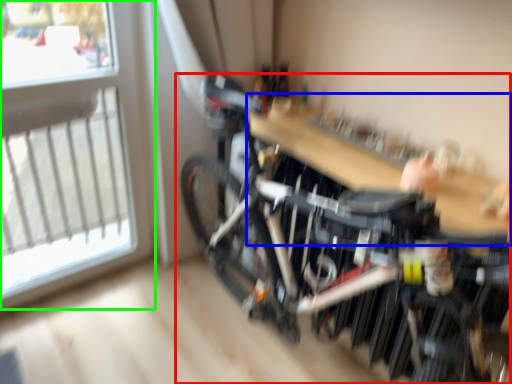
Question: Considering the real-world distances, which object is closest to bicycle (highlighted by a red box)? table (highlighted by a blue box) or window (highlighted by a green box).

Choices:
 (A) table
 (B) window

Answer: (A)